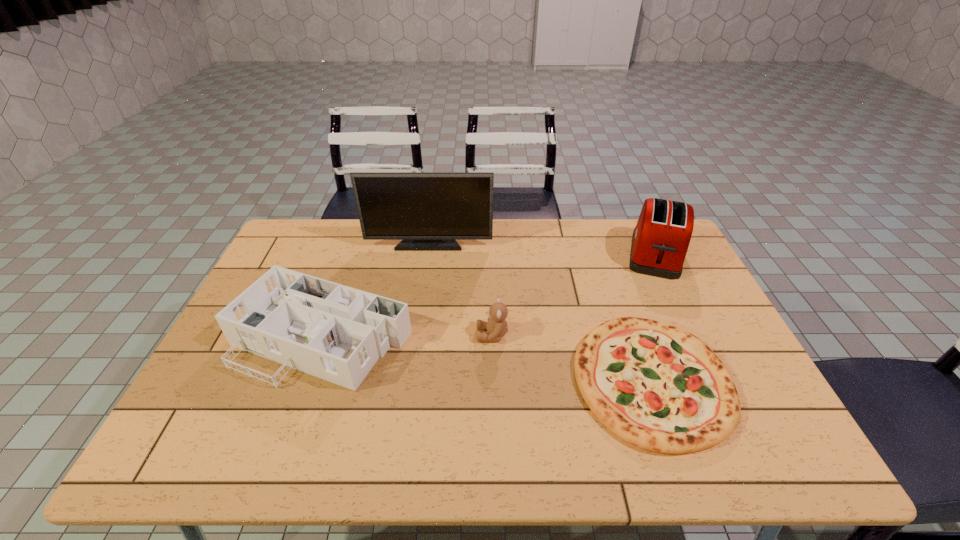
Locate an element on the screen. The width and height of the screenshot is (960, 540). free spot located on the right of the dollhouse is located at coordinates (477, 337).

Locate an element on the screen. vacant space positioned 0.150m on the left of the pizza is located at coordinates (515, 380).

The height and width of the screenshot is (540, 960). Find the location of `monitor situated at the far edge`. monitor situated at the far edge is located at coordinates (428, 211).

The image size is (960, 540). In order to click on toaster that is positioned at the far edge in this screenshot , I will do `click(660, 240)`.

Locate an element on the screen. object at the near edge is located at coordinates pos(658,387).

Where is `object that is at the left edge`? object that is at the left edge is located at coordinates (337, 333).

Identify the location of toaster present at the right edge. The height and width of the screenshot is (540, 960). [x=660, y=240].

Locate an element on the screen. This screenshot has width=960, height=540. pizza that is at the right edge is located at coordinates (658, 387).

Identify the location of object positioned at the far right corner. Image resolution: width=960 pixels, height=540 pixels. (660, 240).

At what (x,y) coordinates should I click in order to perform the action: click on object that is at the near right corner. Please return your answer as a coordinate pair (x, y). Looking at the image, I should click on (658, 387).